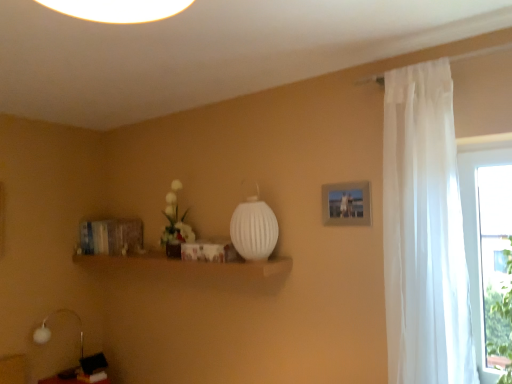
Question: From the image's perspective, is white fabric table lamp at lower left positioned above or below matte silver picture frame at upper right?

Choices:
 (A) below
 (B) above

Answer: (A)

Question: Is white fabric table lamp at lower left inside the boundaries of matte silver picture frame at upper right, or outside?

Choices:
 (A) inside
 (B) outside

Answer: (B)

Question: Which of these objects is positioned farthest from the white ribbed glass vase at center?

Choices:
 (A) white fabric table lamp at lower left
 (B) white sheer curtain at right
 (C) matte silver picture frame at upper right
 (D) green leafy plant at right

Answer: (A)

Question: Considering the real-world distances, which object is farthest from the matte silver picture frame at upper right?

Choices:
 (A) green leafy plant at right
 (B) white sheer curtain at right
 (C) white ribbed glass vase at center
 (D) white fabric table lamp at lower left

Answer: (D)